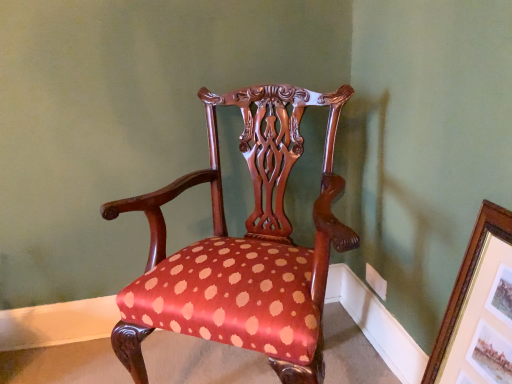
Question: Does gold/gilded picture frame at upper right have a larger size compared to polished wood chair at center?

Choices:
 (A) no
 (B) yes

Answer: (A)

Question: Is gold/gilded picture frame at upper right oriented towards polished wood chair at center?

Choices:
 (A) no
 (B) yes

Answer: (B)

Question: Does gold/gilded picture frame at upper right have a greater width compared to polished wood chair at center?

Choices:
 (A) no
 (B) yes

Answer: (A)

Question: Is polished wood chair at center a part of gold/gilded picture frame at upper right?

Choices:
 (A) yes
 (B) no

Answer: (B)

Question: Is gold/gilded picture frame at upper right positioned beyond the bounds of polished wood chair at center?

Choices:
 (A) no
 (B) yes

Answer: (B)

Question: Is the position of gold/gilded picture frame at upper right more distant than that of polished wood chair at center?

Choices:
 (A) no
 (B) yes

Answer: (A)

Question: From a real-world perspective, is polished wood chair at center located higher than gold/gilded picture frame at upper right?

Choices:
 (A) yes
 (B) no

Answer: (A)

Question: Is polished wood chair at center positioned beyond the bounds of gold/gilded picture frame at upper right?

Choices:
 (A) yes
 (B) no

Answer: (A)

Question: From the image's perspective, is polished wood chair at center under gold/gilded picture frame at upper right?

Choices:
 (A) no
 (B) yes

Answer: (A)

Question: Is polished wood chair at center to the left of gold/gilded picture frame at upper right from the viewer's perspective?

Choices:
 (A) yes
 (B) no

Answer: (A)

Question: Is polished wood chair at center smaller than gold/gilded picture frame at upper right?

Choices:
 (A) no
 (B) yes

Answer: (A)

Question: Can you confirm if polished wood chair at center is shorter than gold/gilded picture frame at upper right?

Choices:
 (A) yes
 (B) no

Answer: (B)

Question: Is gold/gilded picture frame at upper right bigger or smaller than polished wood chair at center?

Choices:
 (A) big
 (B) small

Answer: (B)